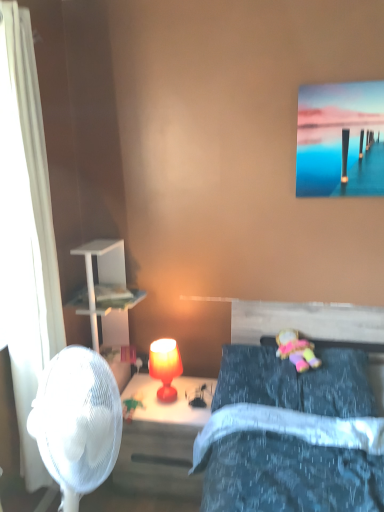
The width and height of the screenshot is (384, 512). I want to click on vacant space situated above velvet blue pillow at lower right (from a real-world perspective), so click(293, 356).